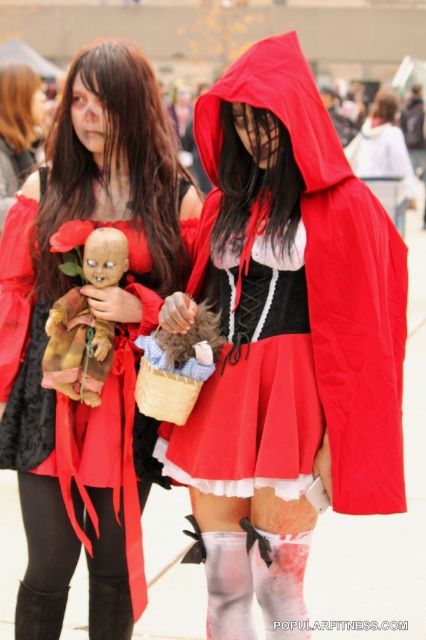
You are a photographer at a costume event. You need to position the matte red cape at center and the distressed brown doll at center so that they are both visible in the frame. Given their sizes, which object should you place closer to the camera to ensure both are fully visible?

The matte red cape at center is bigger than the distressed brown doll at center. To ensure both are fully visible, place the distressed brown doll at center closer to the camera since it is smaller and can be positioned to fit within the frame without being cut off, while the larger cape can be placed slightly farther back but still in view.

You need to place a 30 inch long decorative ribbon between the matte red cape at center and the distressed brown doll at center. Is there enough space to place it without bending the ribbon?

The matte red cape at center is 36.33 inches away from the distressed brown doll at center. Since the ribbon is 30 inches long, there is enough space to place it without bending the ribbon.